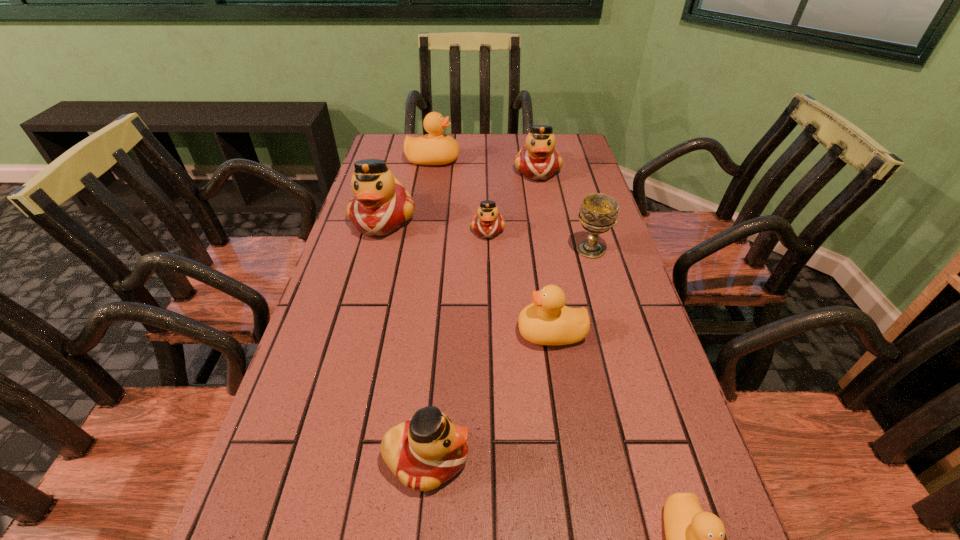
You are a GUI agent. You are given a task and a screenshot of the screen. Output one action in this format:
    pyautogui.click(x=<x>, y=<y>)
    Task: Click on the second yellow duck from left to right
    Image resolution: width=960 pixels, height=540 pixels.
    Given the screenshot: What is the action you would take?
    pyautogui.click(x=547, y=321)

Find the location of a particular element. The image size is (960, 540). the smallest red duck is located at coordinates [x=487, y=223].

Find the location of a particular element. vacant point located 0.060m on the face of the tallest duck is located at coordinates (372, 258).

This screenshot has width=960, height=540. Identify the location of vacant space located on the face of the farthest red duck. (544, 206).

Locate an element on the screen. free space located 0.280m on the face of the farthest yellow duck is located at coordinates point(541,160).

This screenshot has height=540, width=960. Find the location of `free space located on the front of the chalice`. free space located on the front of the chalice is located at coordinates (599, 278).

Find the location of a particular element. The width and height of the screenshot is (960, 540). vacant region located 0.270m on the face of the third biggest red duck is located at coordinates (629, 458).

Find the location of `free space located on the face of the second smallest yellow duck`. free space located on the face of the second smallest yellow duck is located at coordinates (434, 333).

Where is `vacant region located on the face of the second smallest yellow duck`? The height and width of the screenshot is (540, 960). vacant region located on the face of the second smallest yellow duck is located at coordinates (480, 333).

Locate an element on the screen. Image resolution: width=960 pixels, height=540 pixels. free region located 0.110m on the face of the second smallest yellow duck is located at coordinates (467, 333).